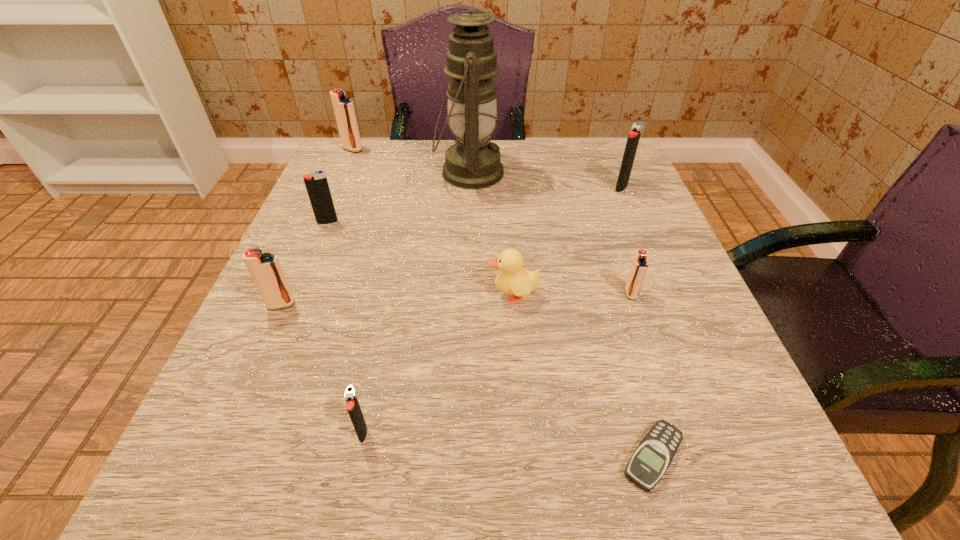
At what (x,y) coordinates should I click in order to perform the action: click on the smallest red igniter. Please return your answer as a coordinate pair (x, y). This screenshot has width=960, height=540. Looking at the image, I should click on (639, 266).

Find the location of `the second black igniter from right to left`. the second black igniter from right to left is located at coordinates (352, 404).

Locate an element on the screen. the nearest black igniter is located at coordinates (352, 404).

At what (x,y) coordinates should I click in order to perform the action: click on beeper. Please return your answer as a coordinate pair (x, y). The width and height of the screenshot is (960, 540). Looking at the image, I should click on [654, 454].

Where is `gray beeper`? gray beeper is located at coordinates (x=654, y=454).

At what (x,y) coordinates should I click in order to perform the action: click on free region located on the left of the tallest object. Please return your answer as a coordinate pair (x, y). This screenshot has width=960, height=540. Looking at the image, I should click on (409, 173).

You are a GUI agent. You are given a task and a screenshot of the screen. Output one action in this format:
    pyautogui.click(x=<x>, y=<y>)
    Task: Click on the vacant region located on the right of the biggest red igniter
    
    Given the screenshot: What is the action you would take?
    [497, 149]

This screenshot has height=540, width=960. I want to click on free space located on the left of the farthest black igniter, so click(507, 188).

At what (x,y) coordinates should I click in order to perform the action: click on vacant space located 0.140m on the back of the third farthest igniter. Please return your answer as a coordinate pair (x, y). Looking at the image, I should click on (344, 183).

What are the coordinates of `vacant space situated 0.250m on the back of the second smallest red igniter` in the screenshot? It's located at (322, 212).